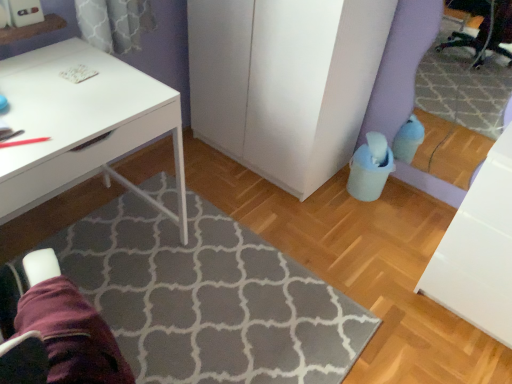
Question: Is gray textured rug at center inside the boundaries of white matte desk at upper left, or outside?

Choices:
 (A) outside
 (B) inside

Answer: (A)

Question: Is gray textured rug at center taller or shorter than white matte desk at upper left?

Choices:
 (A) tall
 (B) short

Answer: (B)

Question: Which of these objects is positioned closest to the white matte desk at upper left?

Choices:
 (A) gray textured rug at center
 (B) purple fabric swivel chair at lower left
 (C) white matte cabinet at center
 (D) white glossy file cabinet at lower right

Answer: (B)

Question: Which is nearer to the purple fabric swivel chair at lower left?

Choices:
 (A) white matte cabinet at center
 (B) white glossy file cabinet at lower right
 (C) gray textured rug at center
 (D) white matte desk at upper left

Answer: (D)